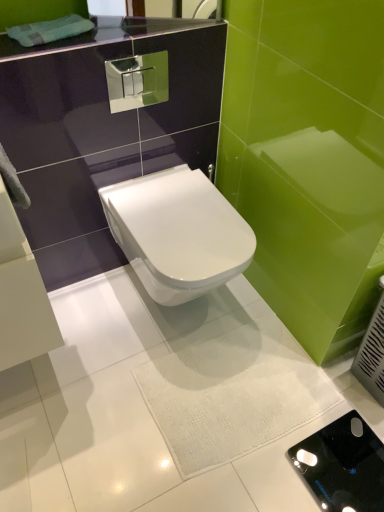
Where is `free point above white glossy toilet at center (from a real-world perspective)`? The image size is (384, 512). free point above white glossy toilet at center (from a real-world perspective) is located at coordinates (186, 215).